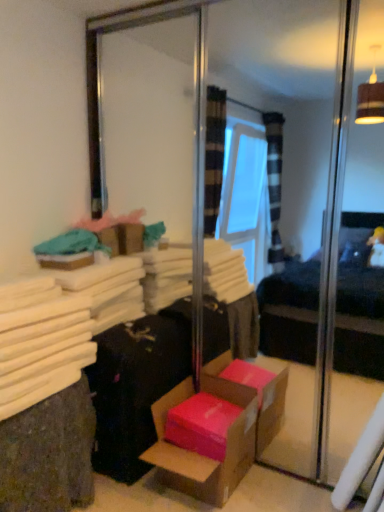
Where is `unoccupied region to the right of pink cardboard box at lower center`? This screenshot has width=384, height=512. unoccupied region to the right of pink cardboard box at lower center is located at coordinates (278, 492).